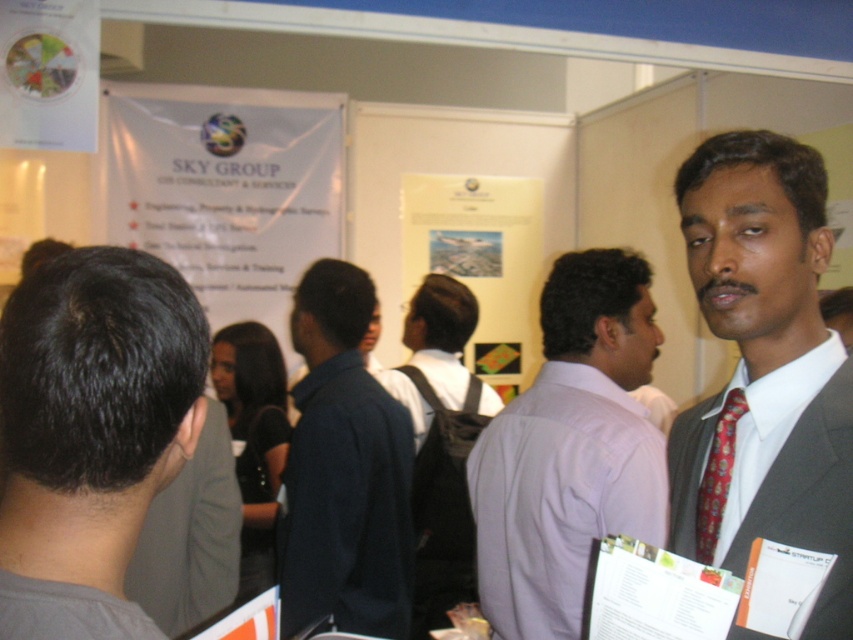
Question: Does dark gray hair at center appear on the right side of red silk tie at right?

Choices:
 (A) yes
 (B) no

Answer: (B)

Question: Which object is positioned closest to the red silk tie at right?

Choices:
 (A) white paper at upper center
 (B) white paper at center
 (C) dark gray hair at center
 (D) white shirt at center

Answer: (B)

Question: Is white paper at upper center further to the viewer compared to red silk tie at right?

Choices:
 (A) no
 (B) yes

Answer: (B)

Question: Among these points, which one is nearest to the camera?

Choices:
 (A) (28, 454)
 (B) (769, 253)
 (C) (404, 440)
 (D) (264, 273)

Answer: (A)

Question: Which object is farther from the camera taking this photo?

Choices:
 (A) white shirt at center
 (B) dark gray hair at center
 (C) red silk tie at right

Answer: (A)

Question: Is matte gray suit at center positioned in front of white shirt at center?

Choices:
 (A) yes
 (B) no

Answer: (A)